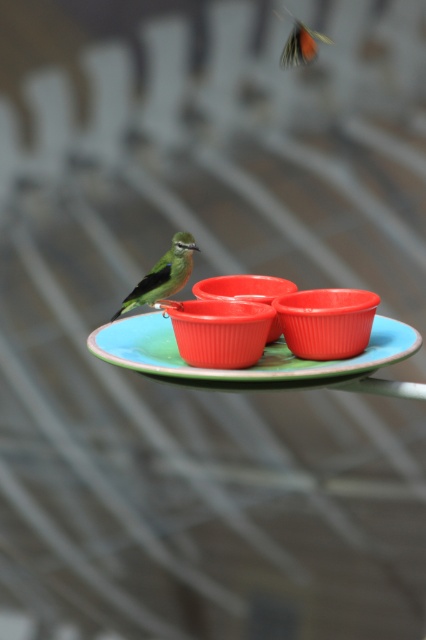
You are a photographer aiming to capture the green matte bird at center and the matte plastic plate at center in a clear shot. Which object should you focus on first if you want the bird to be sharp, considering their positions?

The matte plastic plate at center is positioned on the right side of the green matte bird at center. Since the bird is closer to the camera, you should focus on the green matte bird at center first to ensure it appears sharp in the photo.

Looking at this image, you are a photographer trying to capture the bird feeding from the cups. The bird is currently perched on the matte plastic plate at center. To get a clear shot of the bird and the cups, should you adjust your camera focus to the point at coordinates (x=245, y=368)?

Yes, you should adjust your camera focus to the point at coordinates (x=245, y=368) because that point indicates the matte plastic plate at center where the bird is perched, ensuring the bird and cups are in focus.